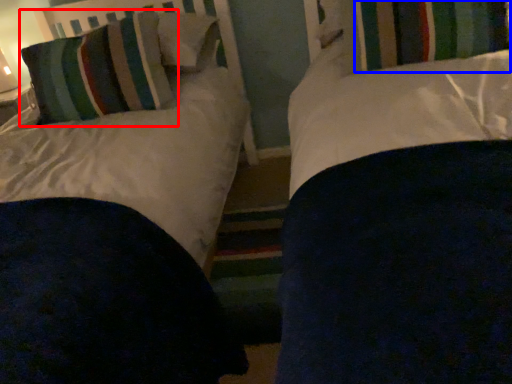
Question: Which object is further to the camera taking this photo, pillow (highlighted by a red box) or curtain (highlighted by a blue box)?

Choices:
 (A) pillow
 (B) curtain

Answer: (A)